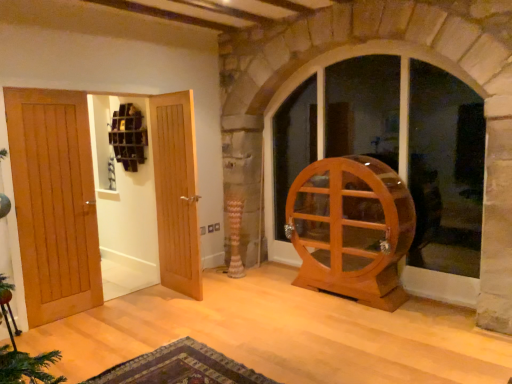
Question: Is light brown wood door at left, which appears as the 2th door when viewed from the right, facing away from light brown wood door at center, marked as the 1th door in a right-to-left arrangement?

Choices:
 (A) yes
 (B) no

Answer: (B)

Question: Does light brown wood door at left, which appears as the 2th door when viewed from the right, have a smaller size compared to light brown wood door at center, marked as the 1th door in a right-to-left arrangement?

Choices:
 (A) yes
 (B) no

Answer: (B)

Question: Is light brown wood door at left, which appears as the 2th door when viewed from the right, positioned before light brown wood door at center, which ranks as the third door in left-to-right order?

Choices:
 (A) yes
 (B) no

Answer: (A)

Question: Is light brown wood door at left, which appears as the 2th door when viewed from the right, at the left side of light brown wood door at center, marked as the 1th door in a right-to-left arrangement?

Choices:
 (A) yes
 (B) no

Answer: (A)

Question: Does light brown wood door at left, positioned as the 2th door in left-to-right order, turn towards light brown wood door at center, which ranks as the third door in left-to-right order?

Choices:
 (A) no
 (B) yes

Answer: (B)

Question: Considering the positions of light brown wood door at center, which ranks as the third door in left-to-right order, and transparent glass cabinet at center in the image, is light brown wood door at center, which ranks as the third door in left-to-right order, taller or shorter than transparent glass cabinet at center?

Choices:
 (A) short
 (B) tall

Answer: (A)

Question: Is light brown wood door at center, which ranks as the third door in left-to-right order, inside the boundaries of transparent glass cabinet at center, or outside?

Choices:
 (A) inside
 (B) outside

Answer: (B)

Question: Is light brown wood door at center, which ranks as the third door in left-to-right order, in front of or behind transparent glass cabinet at center in the image?

Choices:
 (A) behind
 (B) front

Answer: (A)

Question: Considering the relative positions of light brown wood door at center, marked as the 1th door in a right-to-left arrangement, and transparent glass cabinet at center in the image provided, is light brown wood door at center, marked as the 1th door in a right-to-left arrangement, to the left or to the right of transparent glass cabinet at center?

Choices:
 (A) left
 (B) right

Answer: (A)

Question: Does point (373, 145) appear closer or farther from the camera than point (29, 246)?

Choices:
 (A) farther
 (B) closer

Answer: (A)

Question: Is transparent glass cabinet at center bigger or smaller than light brown wood door at left, the 3th door in the right-to-left sequence?

Choices:
 (A) small
 (B) big

Answer: (B)

Question: From a real-world perspective, is transparent glass cabinet at center physically located above or below light brown wood door at left, the 3th door in the right-to-left sequence?

Choices:
 (A) below
 (B) above

Answer: (B)

Question: Do you think transparent glass cabinet at center is within light brown wood door at left, the 1th door viewed from the left, or outside of it?

Choices:
 (A) outside
 (B) inside

Answer: (A)

Question: In terms of width, does carpeted rug at lower center look wider or thinner when compared to light brown wood door at center, marked as the 1th door in a right-to-left arrangement?

Choices:
 (A) wide
 (B) thin

Answer: (A)

Question: Looking at the image, does carpeted rug at lower center seem bigger or smaller compared to light brown wood door at center, marked as the 1th door in a right-to-left arrangement?

Choices:
 (A) small
 (B) big

Answer: (A)